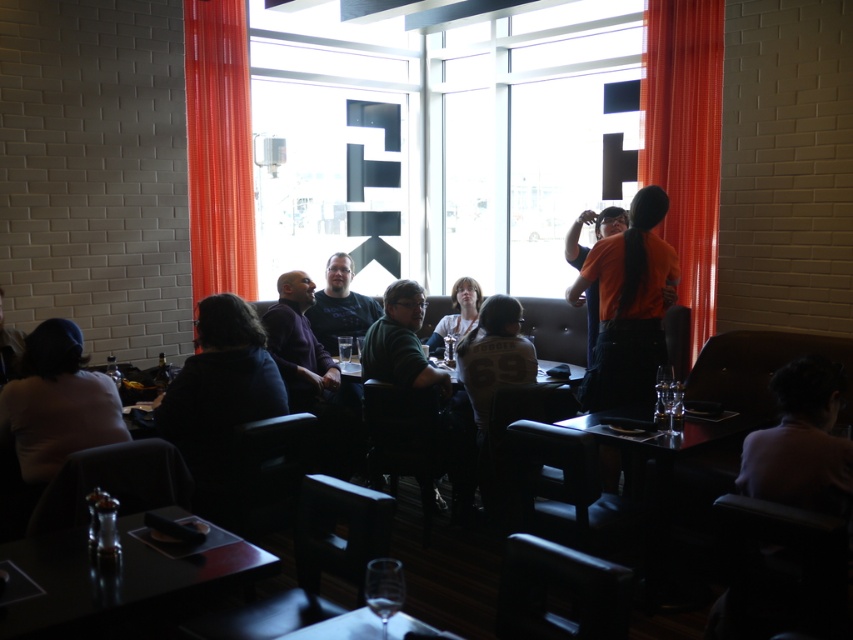
Which is behind, point (22, 353) or point (306, 340)?

Point (306, 340)

Does light pink fabric shirt at lower left appear under dark purple sweater at center?

Yes.

Does point (53, 371) come closer to viewer compared to point (332, 387)?

Yes.

Where is `light pink fabric shirt at lower left`? The image size is (853, 640). light pink fabric shirt at lower left is located at coordinates (57, 403).

Is orange fabric shirt at right behind light pink fabric shirt at lower left?

Yes, orange fabric shirt at right is behind light pink fabric shirt at lower left.

Is point (643, 212) behind point (68, 332)?

That is True.

Locate an element on the screen. The width and height of the screenshot is (853, 640). orange fabric shirt at right is located at coordinates (628, 305).

Is dark purple sweater at center below matte black table at center?

No.

Does dark purple sweater at center have a greater height compared to matte black table at center?

Indeed, dark purple sweater at center has a greater height compared to matte black table at center.

Where is `dark purple sweater at center`? dark purple sweater at center is located at coordinates pyautogui.click(x=299, y=342).